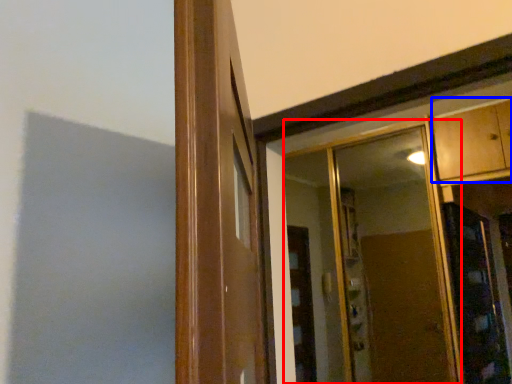
Question: Among these objects, which one is nearest to the camera, mirror (highlighted by a red box) or cabinetry (highlighted by a blue box)?

Choices:
 (A) mirror
 (B) cabinetry

Answer: (B)